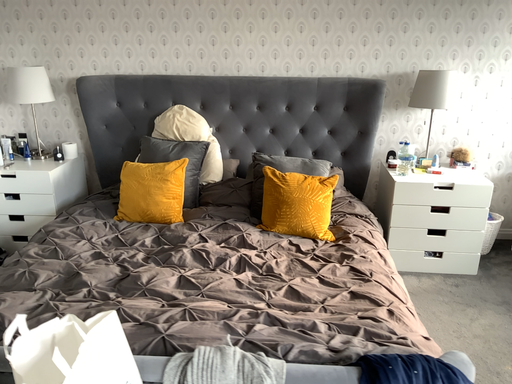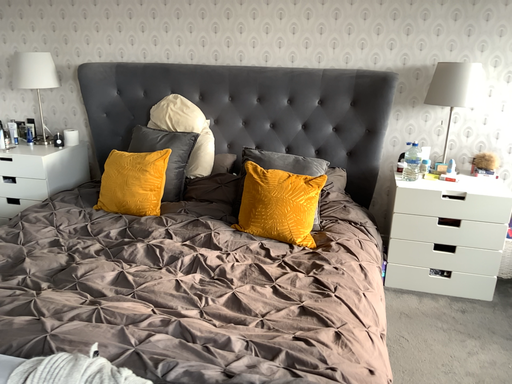
Question: How did the camera likely rotate when shooting the video?

Choices:
 (A) rotated left
 (B) rotated right

Answer: (A)